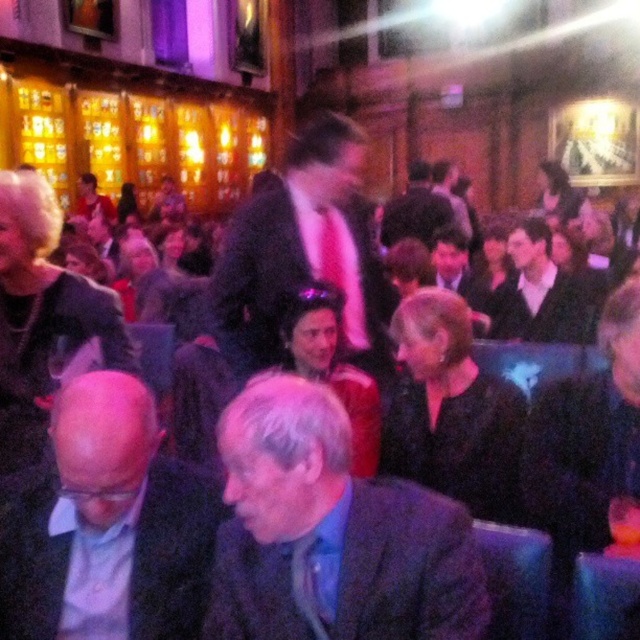
You are at a social event and need to navigate through the crowd. You see a gray woolen suit at lower center and a bald head at center. Which of these two would be easier to maneuver around, considering their size?

The gray woolen suit at lower center occupies less space than the bald head at center, so it would be easier to maneuver around the gray woolen suit at lower center.

You are at a social event and need to locate the pink satin tie at center and the matte black jacket at upper left. Which object is nearer to you?

The pink satin tie at center is closer to the viewer than the matte black jacket at upper left, so the pink satin tie at center is nearer to you.

In the scene shown: You are at a social event and want to get a closer look at the bald head at center without obstructing the view of the gray woolen suit at lower center. Is there a way to do this?

The gray woolen suit at lower center is in front of the bald head at center, so you would need to move around the gray woolen suit at lower center to get an unobstructed view of the bald head at center.